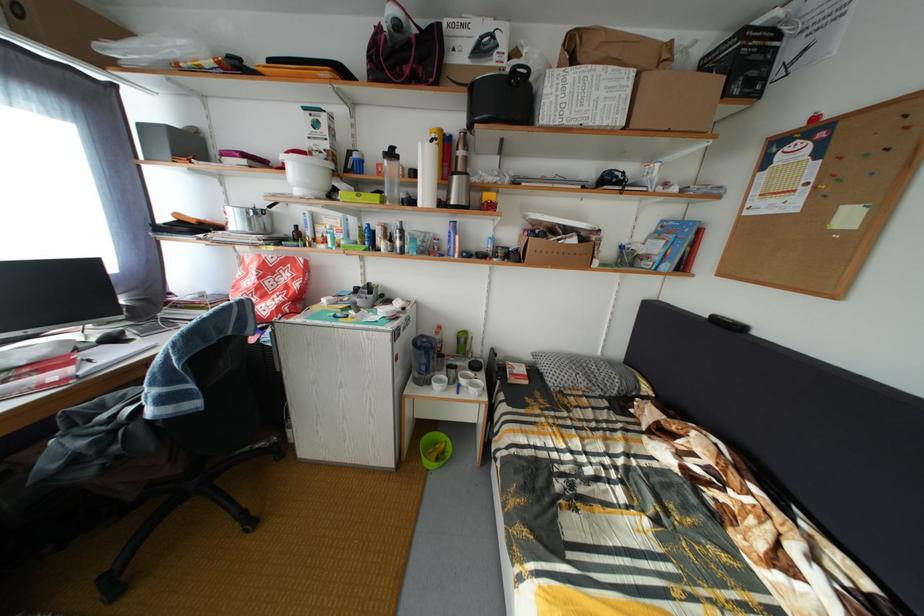
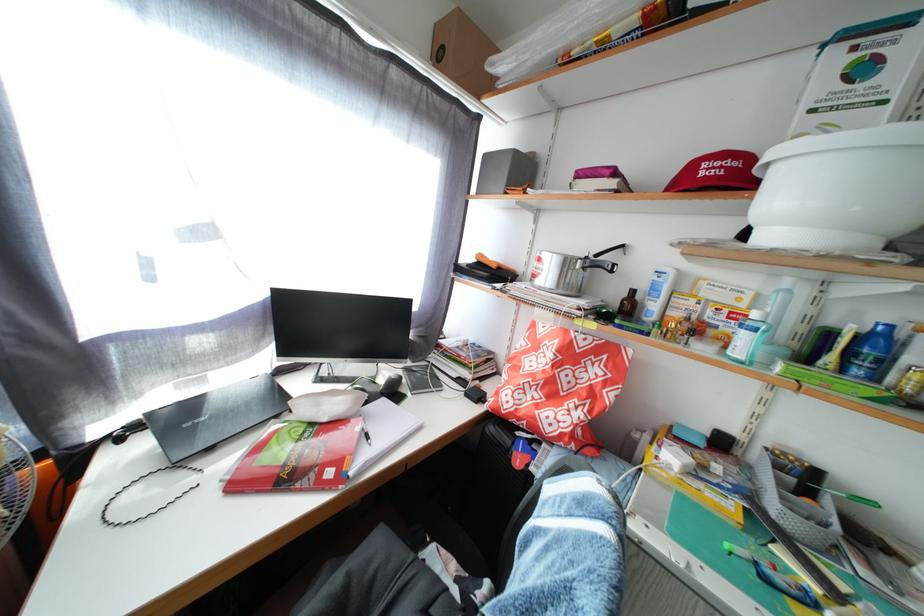
Where in the second image is the point corresponding to pixel 62 386 from the first image?

(338, 480)